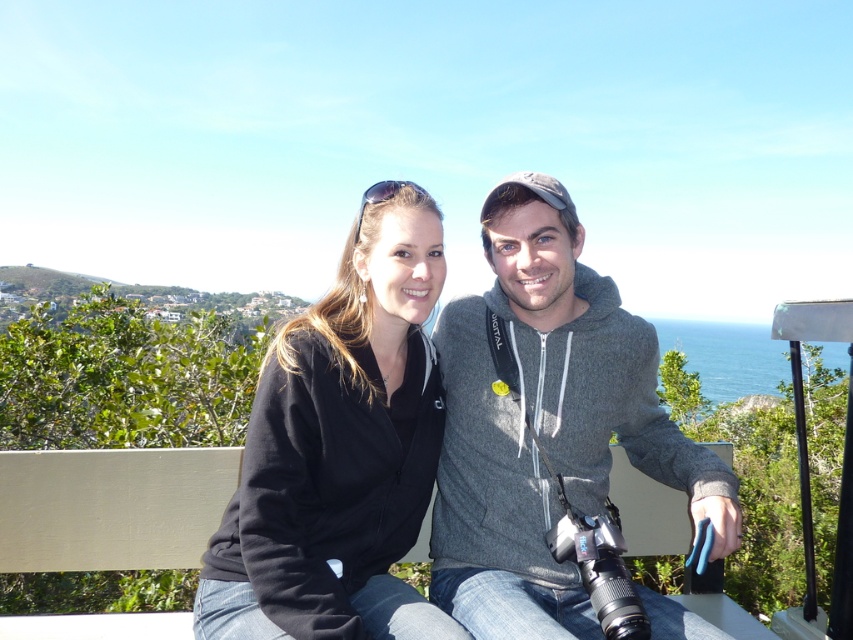
You are a fashion designer analyzing the clothing items in the scene. You need to determine which clothing item is bigger between the gray fleece hoodie at center and the black fleece jacket at center. Which one is larger?

The gray fleece hoodie at center is larger in size than the black fleece jacket at center.

You are a fashion designer observing the two individuals in the image. You need to determine which clothing item is positioned higher on their bodies. Which one is higher between the gray fleece hoodie at center and the black fleece jacket at center?

The gray fleece hoodie at center is located above the black fleece jacket at center, so it is positioned higher on their bodies.

You are a fashion designer analyzing the clothing items in the image. Which clothing item is taller between the gray fleece hoodie at center and the black fleece jacket at center?

The gray fleece hoodie at center is taller than the black fleece jacket at center according to the description.